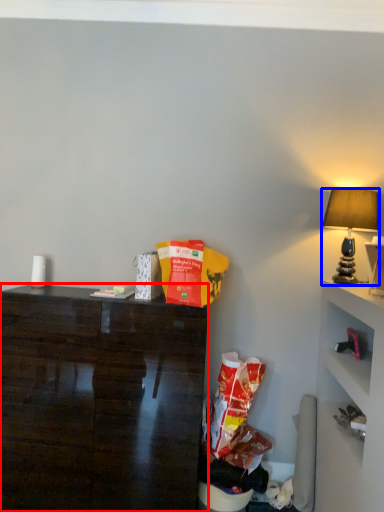
Question: Among these objects, which one is nearest to the camera, desk (highlighted by a red box) or lamp (highlighted by a blue box)?

Choices:
 (A) desk
 (B) lamp

Answer: (A)